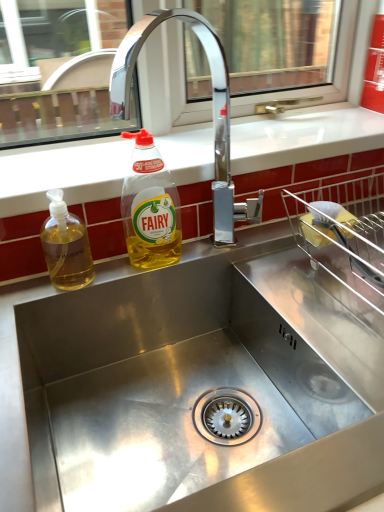
Find the location of a particular element. The image size is (384, 512). free location to the right of translucent yellow liquid at sink left, the 2th bottle when ordered from right to left is located at coordinates (138, 281).